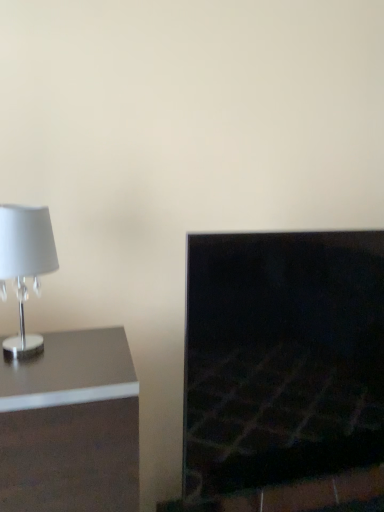
Identify the location of free space in front of white glossy lampshade at left. This screenshot has width=384, height=512. (37, 382).